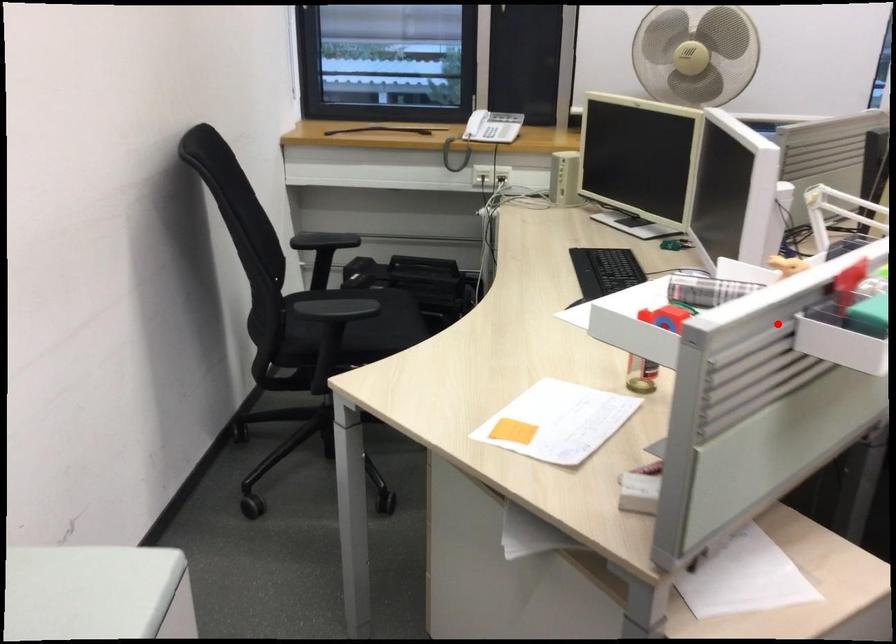
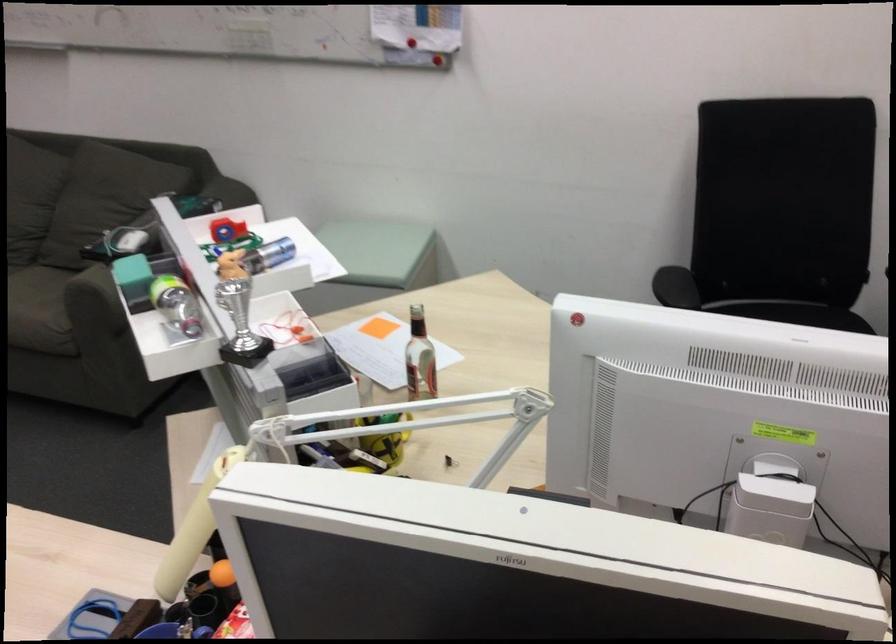
Locate, in the second image, the point that corresponds to the highlighted location in the first image.

(240, 324)